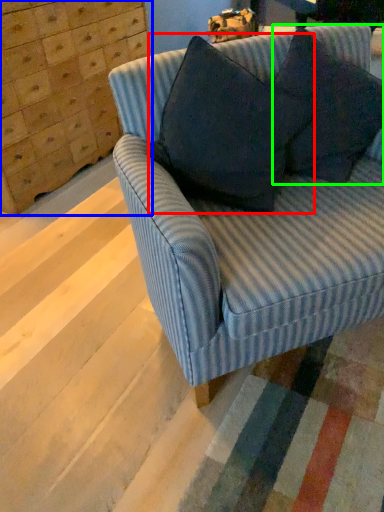
Question: Which object is positioned farthest from throw pillow (highlighted by a red box)? Select from dresser (highlighted by a blue box) and throw pillow (highlighted by a green box).

Choices:
 (A) dresser
 (B) throw pillow

Answer: (A)